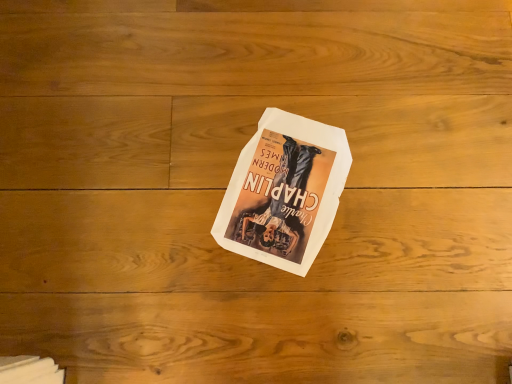
At what (x,y) coordinates should I click in order to perform the action: click on white paper at center. Please return your answer as a coordinate pair (x, y). The image size is (512, 384). Looking at the image, I should click on (284, 191).

Describe the element at coordinates (284, 191) in the screenshot. I see `white paper at center` at that location.

I want to click on white paper at center, so click(284, 191).